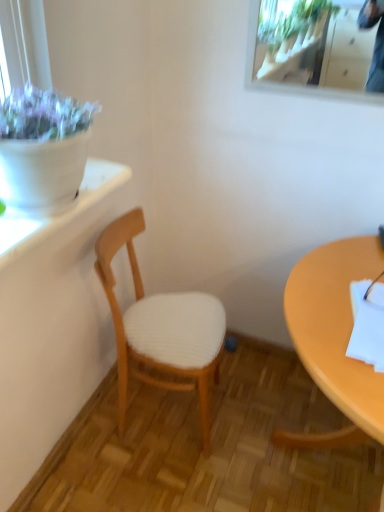
What are the coordinates of `vacant space to the right of wooden chair at center` in the screenshot? It's located at (240, 400).